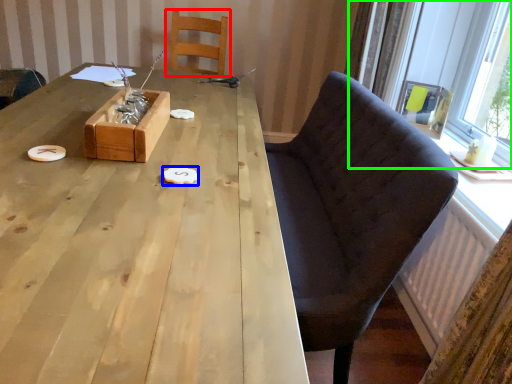
Question: Considering the real-world distances, which object is closest to chair (highlighted by a red box)? food (highlighted by a blue box) or window (highlighted by a green box).

Choices:
 (A) food
 (B) window

Answer: (B)